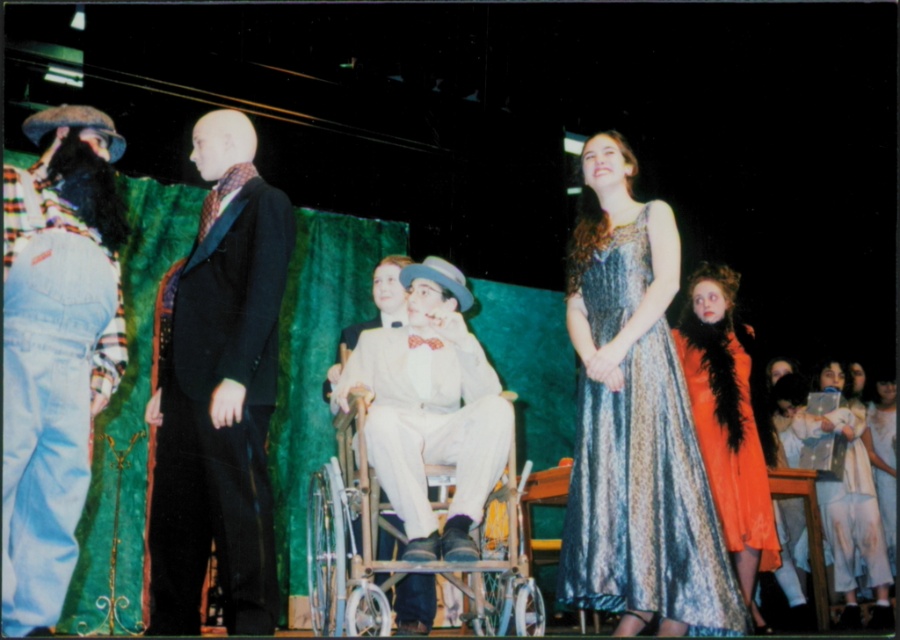
You are an audience member sitting in the front row. You notice two performers on stage wearing a white satin suit at center and a shiny orange dress at right. Which performer is standing closer to you?

The white satin suit at center is closer to the viewer than the shiny orange dress at right, so the performer in the white satin suit at center is standing closer to you.

You are an audience member sitting in the middle of the theater. You notice two characters on stage, the denim jeans at left and the shiny orange dress at right. Which character is closer to you?

The denim jeans at left is in front of the shiny orange dress at right, so the denim jeans at left is closer to you.

You are an audience member sitting in the front row of the theater. You notice two dresses on stage. The first is a shiny metallic dress at center and the second is a white lace dress at lower right. Which dress is positioned to the left when viewed from your seat?

The shiny metallic dress at center is positioned to the left of the white lace dress at lower right.